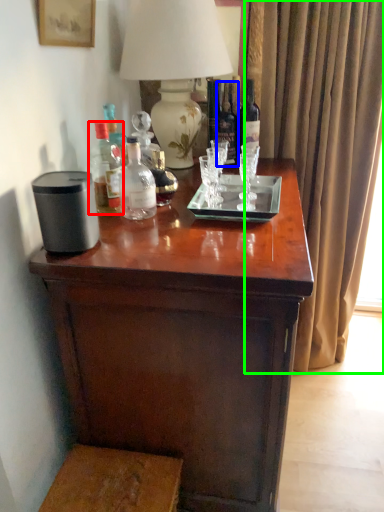
Question: Considering the real-world distances, which object is farthest from bottle (highlighted by a red box)? bottle (highlighted by a blue box) or curtain (highlighted by a green box)?

Choices:
 (A) bottle
 (B) curtain

Answer: (B)